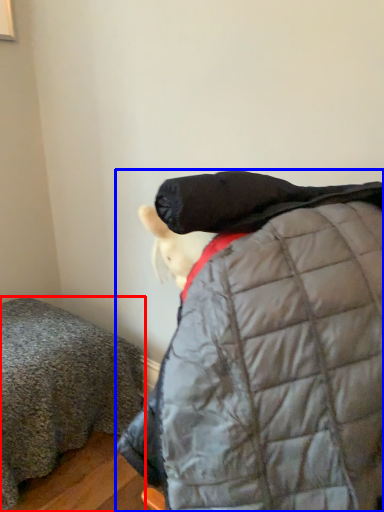
Question: Which object appears farthest to the camera in this image, furniture (highlighted by a red box) or jacket (highlighted by a blue box)?

Choices:
 (A) furniture
 (B) jacket

Answer: (A)